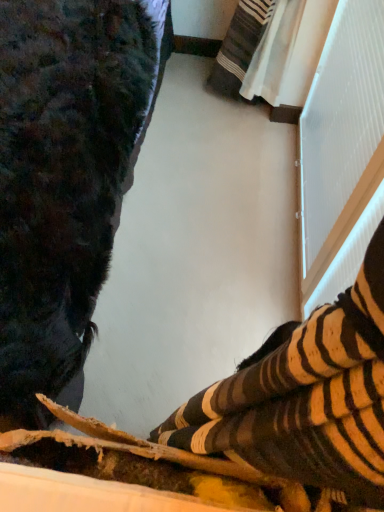
Identify the location of fuzzy black cat at lower left. This screenshot has width=384, height=512. (66, 179).

Describe the element at coordinates (66, 179) in the screenshot. This screenshot has height=512, width=384. I see `fuzzy black cat at lower left` at that location.

Locate an element on the screen. This screenshot has height=512, width=384. fuzzy black cat at lower left is located at coordinates (66, 179).